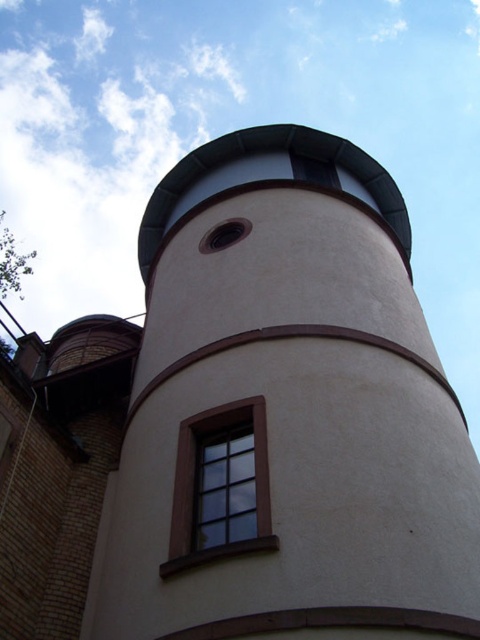
Between smooth beige tower at center and brown wooden window at center, which one appears on the right side from the viewer's perspective?

Positioned to the right is smooth beige tower at center.

Is point (345, 144) positioned in front of point (247, 422)?

No, it is not.

Is point (377, 500) less distant than point (181, 547)?

Yes, it is.

The width and height of the screenshot is (480, 640). I want to click on smooth beige tower at center, so click(x=285, y=412).